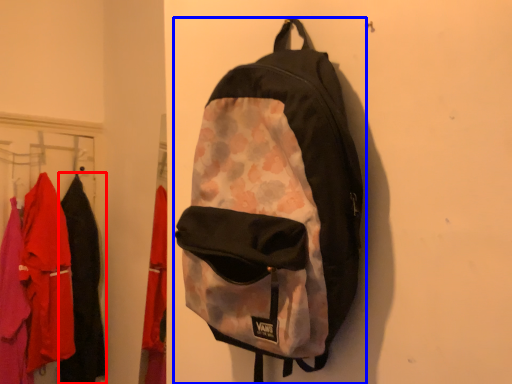
Question: Among these objects, which one is nearest to the camera, clothing (highlighted by a red box) or backpack (highlighted by a blue box)?

Choices:
 (A) clothing
 (B) backpack

Answer: (B)